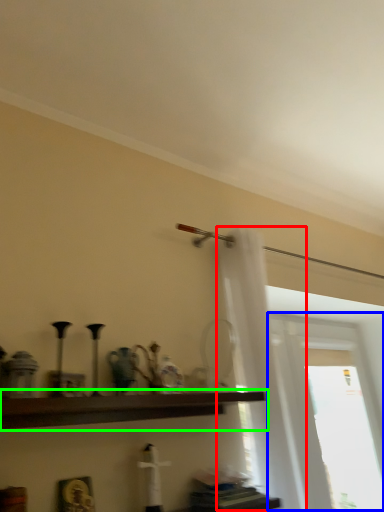
Question: Which object is positioned closest to shower curtain (highlighted by a red box)? Select from window (highlighted by a blue box) and shelf (highlighted by a green box).

Choices:
 (A) window
 (B) shelf

Answer: (B)